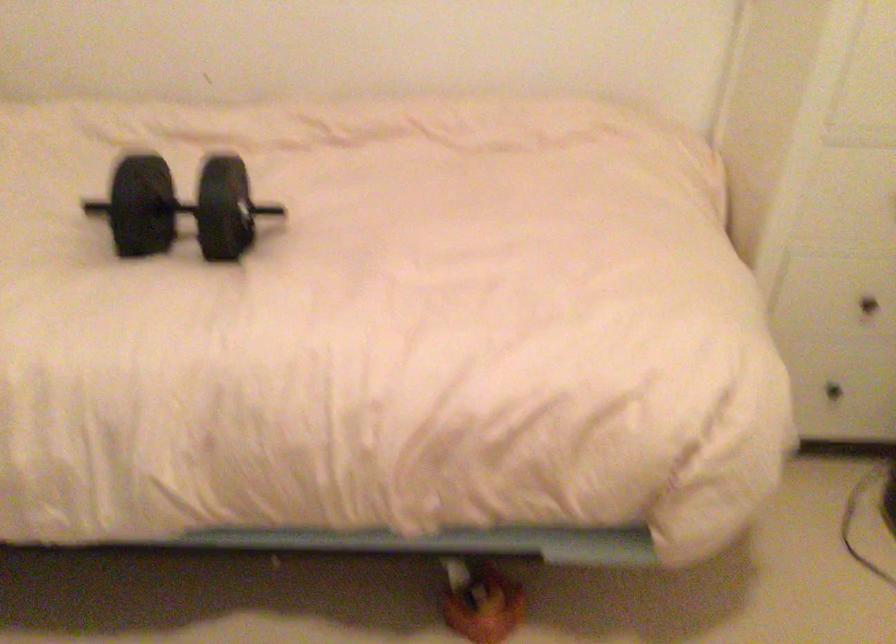
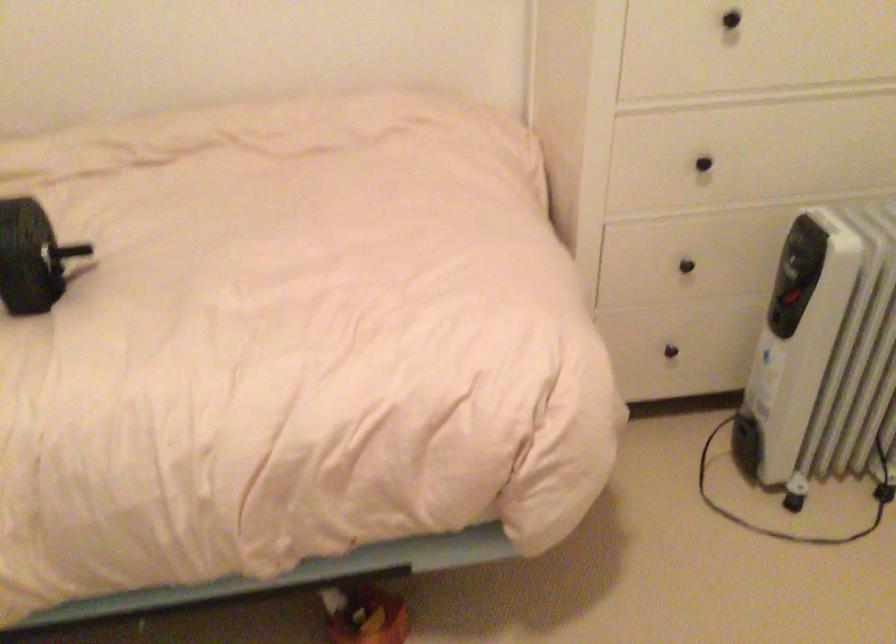
Find the pixel in the second image that matches (x=230, y=212) in the first image.

(30, 257)